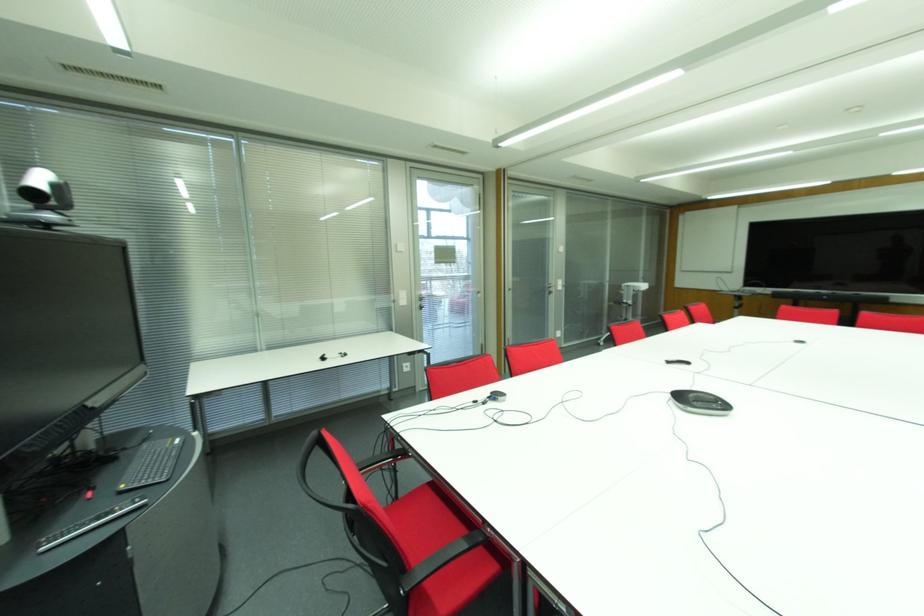
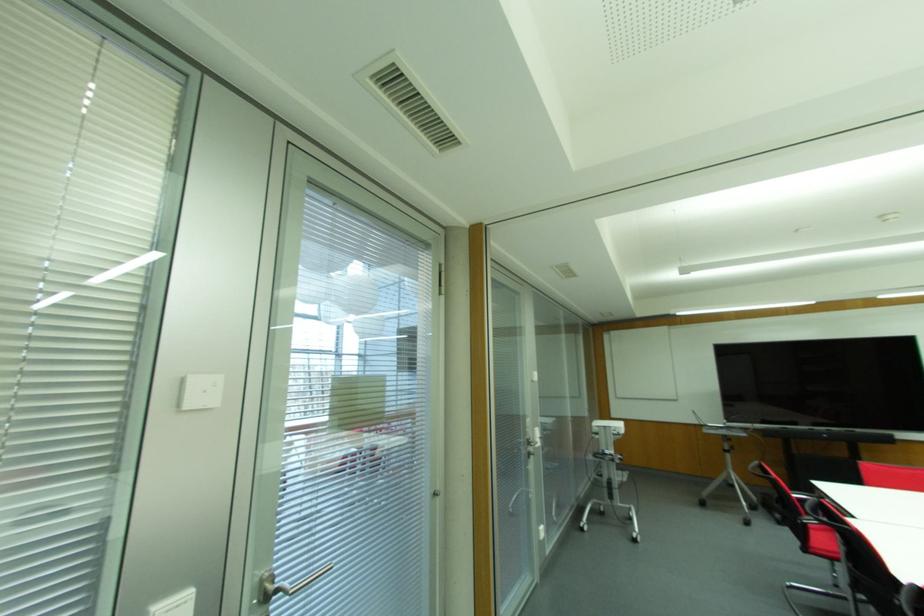
Find the pixel in the second image that matches [420,299] in the first image.

(266, 596)